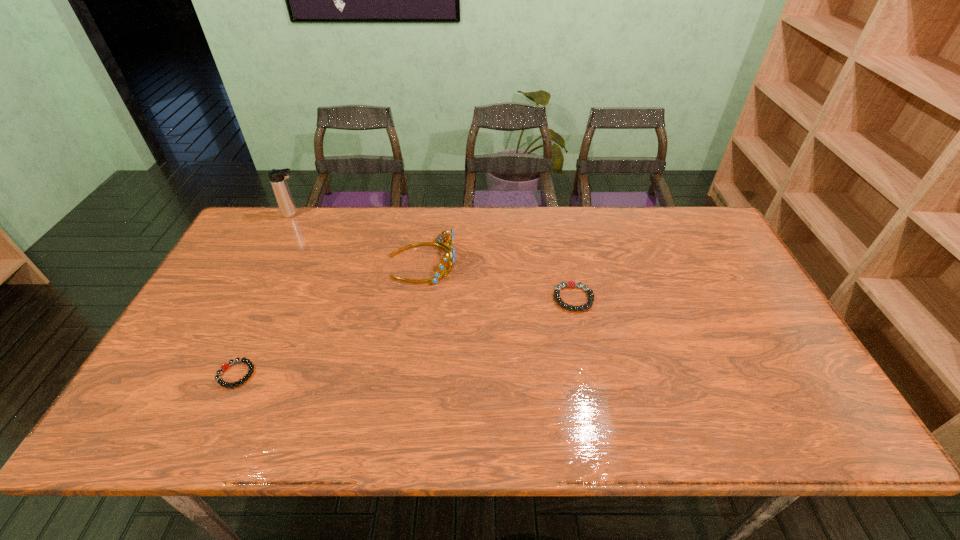
Locate an element on the screen. free space at the far left corner of the desktop is located at coordinates (289, 230).

This screenshot has width=960, height=540. In order to click on free space at the far right corner of the desktop in this screenshot , I will do `click(704, 229)`.

Image resolution: width=960 pixels, height=540 pixels. In order to click on vacant region between the farther bracelet and the thermos bottle in this screenshot , I will do `click(434, 256)`.

Locate an element on the screen. vacant area that lies between the taller bracelet and the nearer bracelet is located at coordinates (405, 336).

Image resolution: width=960 pixels, height=540 pixels. I want to click on free spot between the thermos bottle and the right bracelet, so click(434, 256).

Locate an element on the screen. This screenshot has height=540, width=960. vacant space in between the shortest object and the tallest object is located at coordinates (265, 294).

Identify the location of free space between the taller bracelet and the third shortest object. The height and width of the screenshot is (540, 960). coord(498,280).

I want to click on free space that is in between the third shortest object and the shorter bracelet, so click(x=329, y=318).

The width and height of the screenshot is (960, 540). Find the location of `free space between the tiara and the thermos bottle`. free space between the tiara and the thermos bottle is located at coordinates (358, 238).

Where is `free space between the nearest object and the tiara`? The image size is (960, 540). free space between the nearest object and the tiara is located at coordinates coord(329,318).